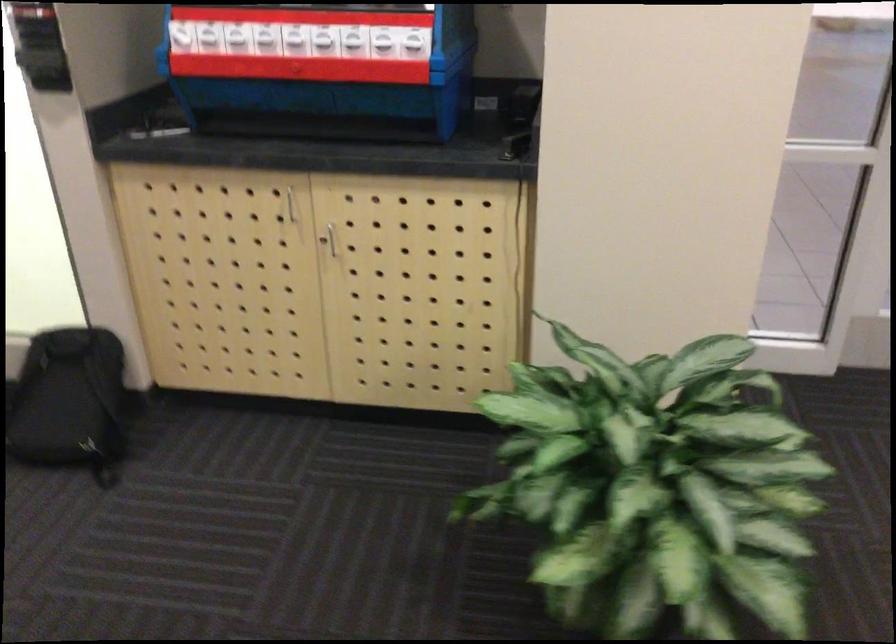
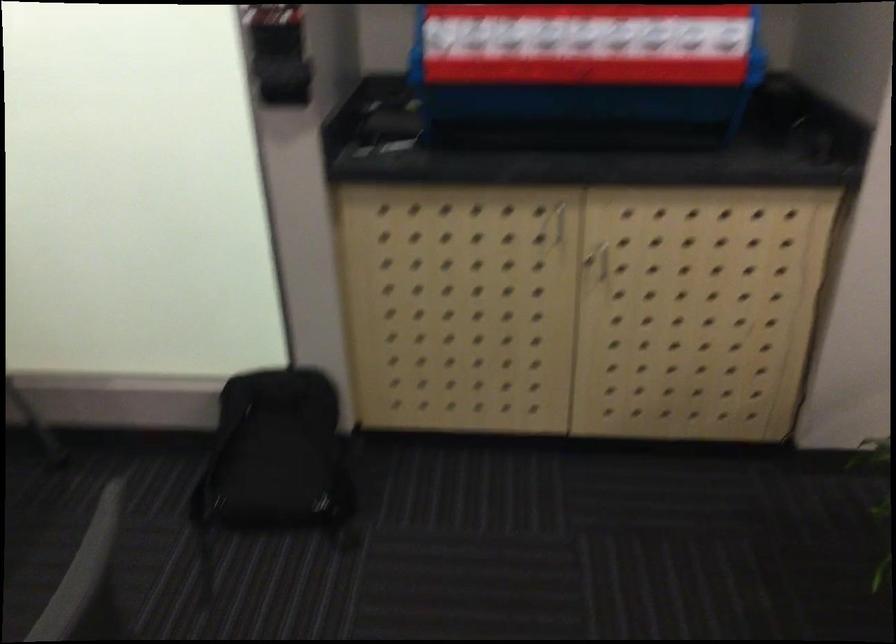
The point at (331, 243) is marked in the first image. Where is the corresponding point in the second image?

(604, 261)